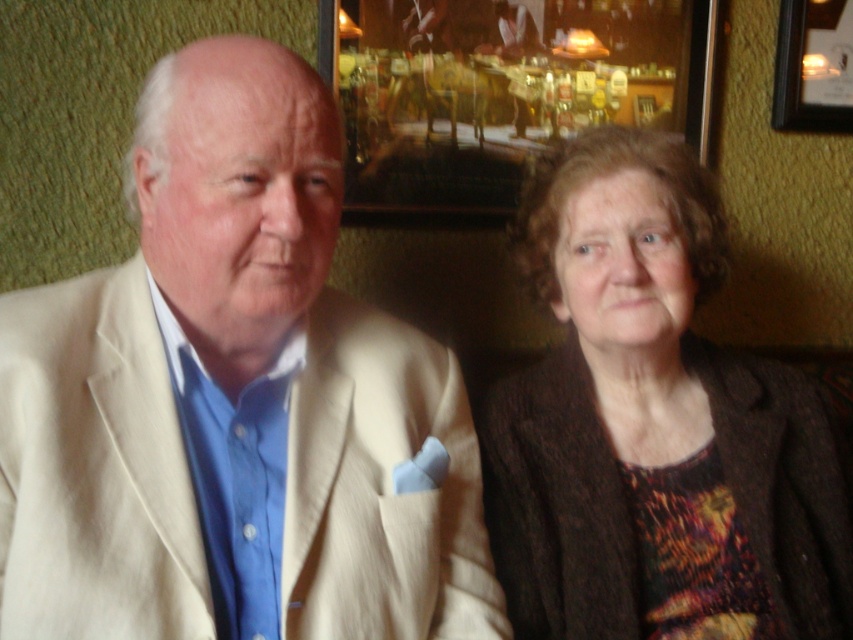
Question: Which object is the closest to the brown textured sweater at right?

Choices:
 (A) beige fabric suit at left
 (B) wooden frame at upper center

Answer: (A)

Question: Can you confirm if wooden frame at upper center is bigger than wooden picture frame at upper right?

Choices:
 (A) no
 (B) yes

Answer: (B)

Question: Among these objects, which one is nearest to the camera?

Choices:
 (A) wooden picture frame at upper right
 (B) wooden frame at upper center
 (C) beige fabric suit at left

Answer: (C)

Question: Which object is the farthest from the beige fabric suit at left?

Choices:
 (A) wooden picture frame at upper right
 (B) wooden frame at upper center

Answer: (A)

Question: Where is beige fabric suit at left located in relation to wooden frame at upper center in the image?

Choices:
 (A) above
 (B) below

Answer: (B)

Question: Does beige fabric suit at left appear under wooden frame at upper center?

Choices:
 (A) no
 (B) yes

Answer: (B)